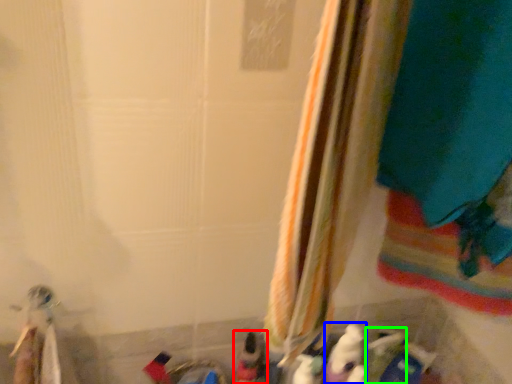
Question: Which object is positioned closest to toy (highlighted by a red box)? Select from toy (highlighted by a blue box) and toy (highlighted by a green box).

Choices:
 (A) toy
 (B) toy

Answer: (A)